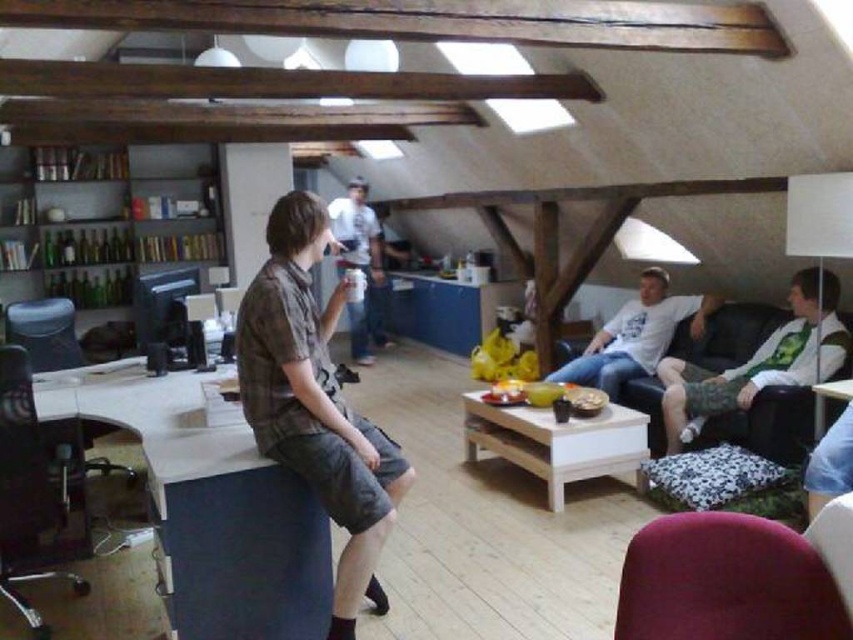
You are moving a new piece of furniture into the room. The black leather armchair at left and the white cotton shirt at right are in the way. Which object should you move first to create space for the new furniture?

The black leather armchair at left is thinner than the white cotton shirt at right, so you should move the white cotton shirt at right first to create more space.

You are organizing a clothing inventory and need to stack the plaid cotton shirt at center and the white cotton shirt at center. Which one should be placed on top to ensure the one in front is visible?

The plaid cotton shirt at center should be placed on top of the white cotton shirt at center since it is already positioned in front, making it visible.

You are arranging a small gathering in this space and need to place a decorative vase between the plaid cotton shirt at center and the black leather armchair at left. Based on their positions, which object should the vase be closer to?

The vase should be closer to the black leather armchair at left because the plaid cotton shirt at center is positioned to the right of the black leather armchair at left.